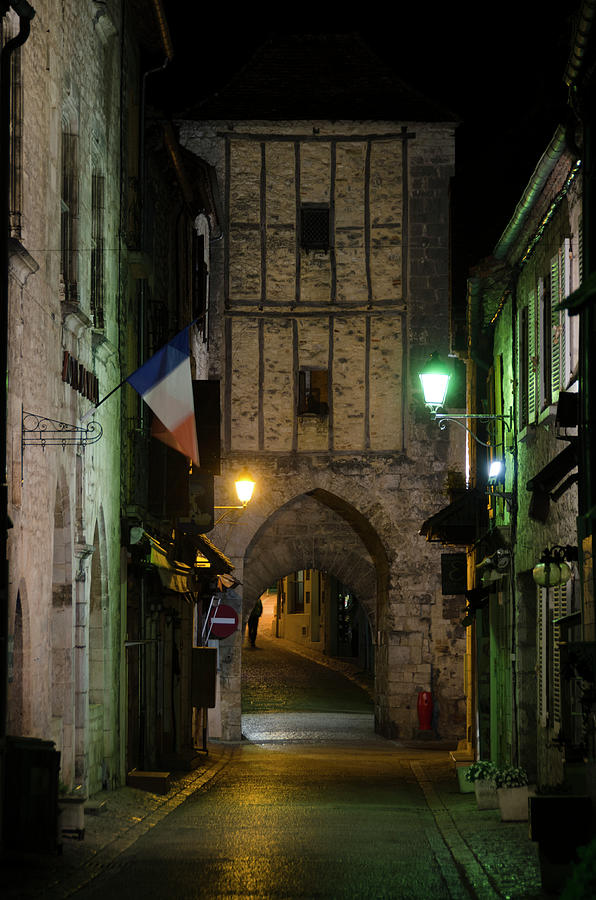
Where is `plants in pot`? plants in pot is located at coordinates (516, 778), (484, 770).